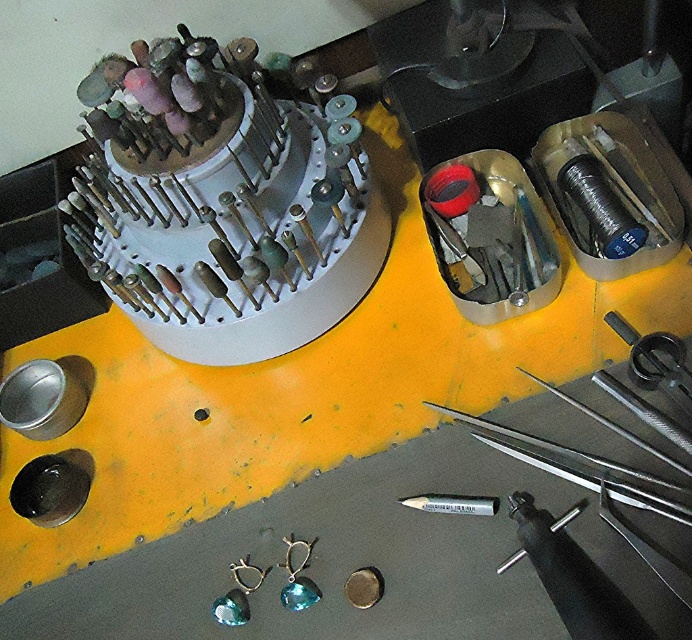
What object is located at the point with coordinates (221, 205)?

The point with coordinates (221, 205) indicates the white plastic grinding wheel at upper center.

You are standing at the yellow section of the workspace and want to reach both the point at coordinates point [125,212] and the point at coordinates point [610,314]. Which point should you reach first to minimize the distance traveled?

You should reach point [610,314] first because it is closer to you than point [125,212], which is further away.

Where is the white plastic grinding wheel at upper center located in the workspace?

The white plastic grinding wheel at upper center is located at point (221, 205) in the workspace.